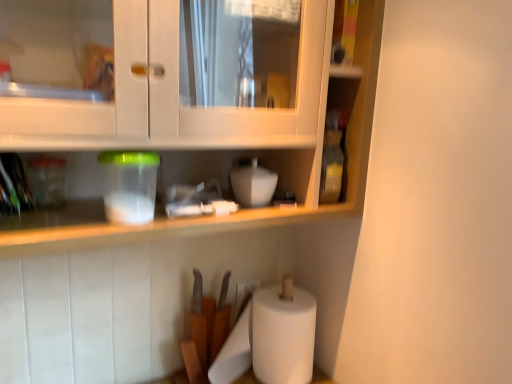
Question: Visually, is white matte bowl at center, positioned as the 1th appliance in back-to-front order, positioned to the left or to the right of translucent plastic container at upper left, which is the 1th appliance in front-to-back order?

Choices:
 (A) right
 (B) left

Answer: (A)

Question: From a real-world perspective, is white matte bowl at center, positioned as the 1th appliance in back-to-front order, positioned above or below translucent plastic container at upper left, the 2th appliance from the back?

Choices:
 (A) above
 (B) below

Answer: (B)

Question: From the image's perspective, is white matte bowl at center, which is the first appliance in right-to-left order, positioned above or below translucent plastic container at upper left, which is the 1th appliance in front-to-back order?

Choices:
 (A) above
 (B) below

Answer: (A)

Question: In terms of height, does translucent plastic container at upper left, the 2th appliance from the back, look taller or shorter compared to white matte bowl at center, positioned as the 1th appliance in back-to-front order?

Choices:
 (A) short
 (B) tall

Answer: (B)

Question: From the image's perspective, is translucent plastic container at upper left, which ranks as the first appliance in left-to-right order, located above or below white matte bowl at center, which is the first appliance in right-to-left order?

Choices:
 (A) above
 (B) below

Answer: (B)

Question: From a real-world perspective, relative to white matte bowl at center, which is the first appliance in right-to-left order, is translucent plastic container at upper left, which is the second appliance in right-to-left order, vertically above or below?

Choices:
 (A) below
 (B) above

Answer: (B)

Question: In terms of size, does translucent plastic container at upper left, the 2th appliance from the back, appear bigger or smaller than white matte bowl at center, which is the first appliance in right-to-left order?

Choices:
 (A) big
 (B) small

Answer: (A)